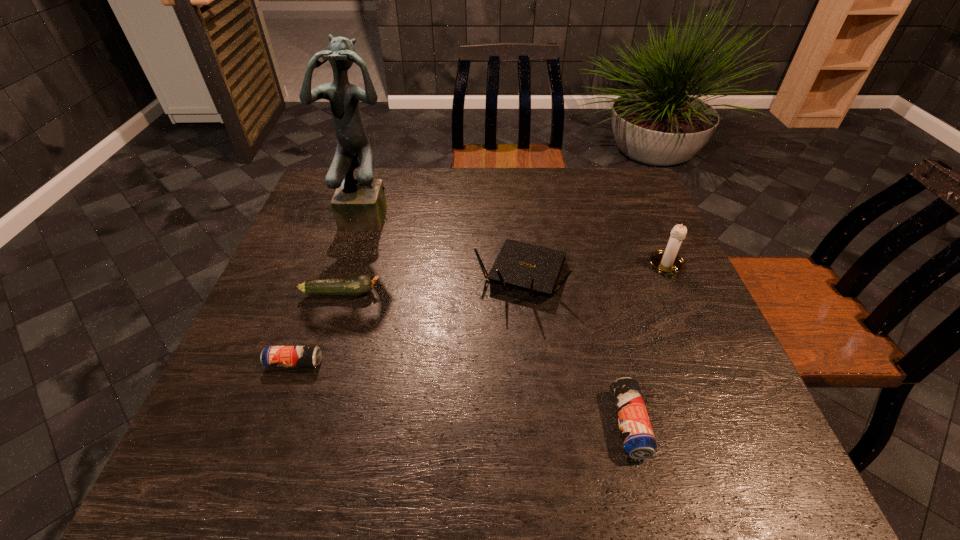
In order to click on the shorter beer can in this screenshot , I will do `click(273, 356)`.

This screenshot has width=960, height=540. What are the coordinates of `the fifth farthest object` in the screenshot? It's located at (273, 356).

Where is `the right beer can`? Image resolution: width=960 pixels, height=540 pixels. the right beer can is located at coordinates (637, 435).

Find the location of a particular element. the nearest object is located at coordinates (637, 435).

Identify the location of candle holder. This screenshot has height=540, width=960. pos(667,261).

Find the location of a particular element. This screenshot has width=960, height=540. the rightmost object is located at coordinates (667, 261).

Locate an element on the screen. Image resolution: width=960 pixels, height=540 pixels. router is located at coordinates (531, 268).

At what (x,y) coordinates should I click in order to perform the action: click on the fourth object from left to right. Please return your answer as a coordinate pair (x, y). Looking at the image, I should click on (531, 268).

Find the location of a particular element. Image resolution: width=960 pixels, height=540 pixels. the tallest object is located at coordinates (359, 204).

Where is `the farthest object`? the farthest object is located at coordinates (359, 204).